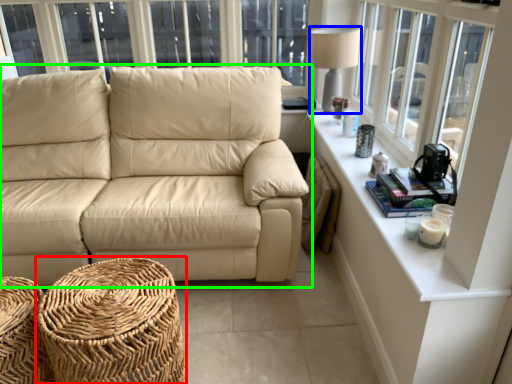
Question: Which object is the closest to the footrest (highlighted by a red box)? Choose among these: table lamp (highlighted by a blue box) or studio couch (highlighted by a green box).

Choices:
 (A) table lamp
 (B) studio couch

Answer: (B)